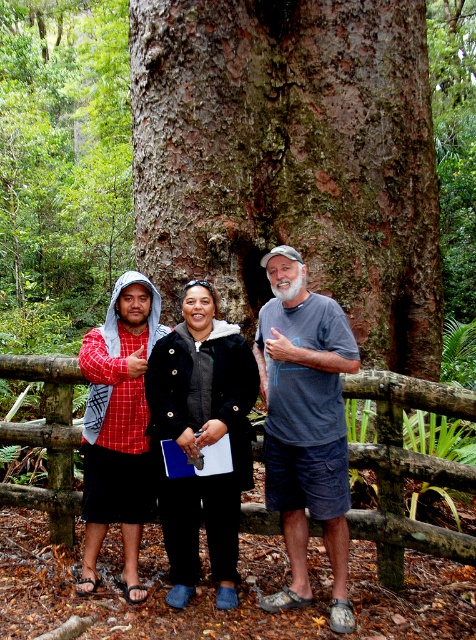
Question: Does gray cotton t-shirt at center come behind wooden at center?

Choices:
 (A) yes
 (B) no

Answer: (A)

Question: Does wooden at center appear under red plaid shirt at left?

Choices:
 (A) no
 (B) yes

Answer: (B)

Question: Among these objects, which one is nearest to the camera?

Choices:
 (A) wooden at center
 (B) red plaid shirt at left
 (C) gray cotton t-shirt at center

Answer: (A)

Question: Does wooden at center have a smaller size compared to red plaid shirt at left?

Choices:
 (A) yes
 (B) no

Answer: (A)

Question: Which object is positioned closest to the gray cotton t-shirt at center?

Choices:
 (A) black fuzzy jacket at center
 (B) wooden at center
 (C) red plaid shirt at left

Answer: (A)

Question: Which of these objects is positioned closest to the gray cotton t-shirt at center?

Choices:
 (A) wooden at center
 (B) black fuzzy jacket at center

Answer: (B)